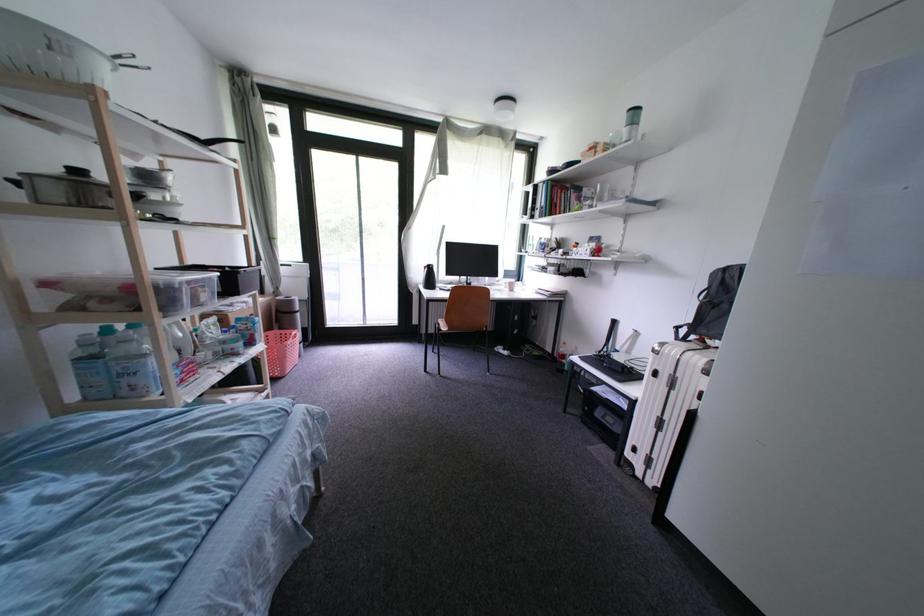
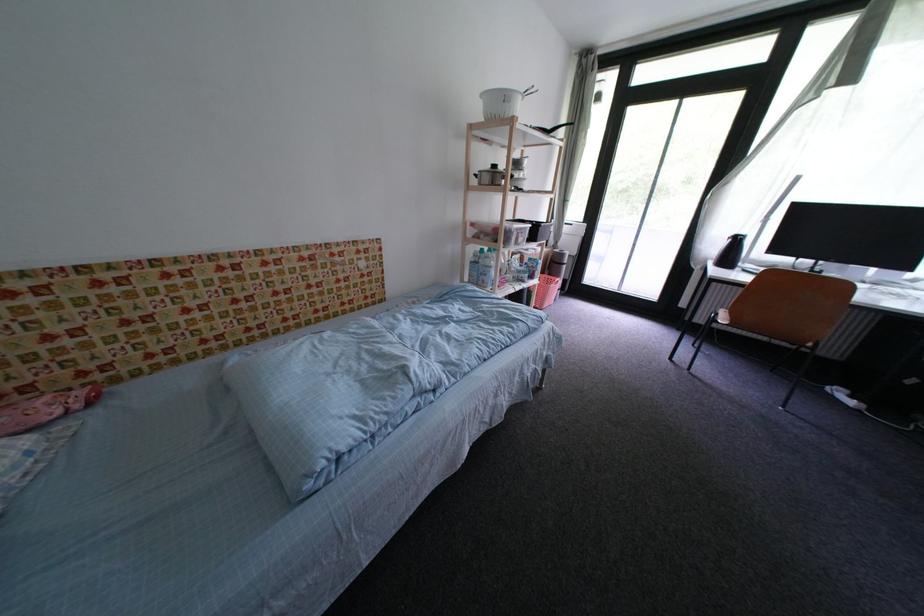
In the second image, find the point that corresponds to point (259, 346) in the first image.

(540, 280)